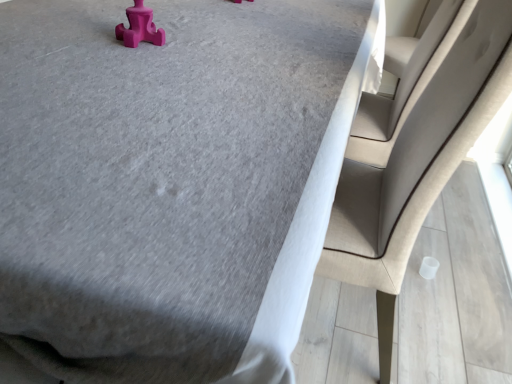
Question: Is beige fabric chair at right closer to the viewer compared to pink rubber toy at upper left?

Choices:
 (A) yes
 (B) no

Answer: (A)

Question: From the image's perspective, is beige fabric chair at right below pink rubber toy at upper left?

Choices:
 (A) yes
 (B) no

Answer: (A)

Question: Would you say beige fabric chair at right is a long distance from pink rubber toy at upper left?

Choices:
 (A) no
 (B) yes

Answer: (A)

Question: Considering the relative sizes of beige fabric chair at right and pink rubber toy at upper left in the image provided, is beige fabric chair at right shorter than pink rubber toy at upper left?

Choices:
 (A) no
 (B) yes

Answer: (A)

Question: Can you confirm if beige fabric chair at right is positioned to the left of pink rubber toy at upper left?

Choices:
 (A) no
 (B) yes

Answer: (A)

Question: Is beige fabric chair at right looking in the opposite direction of pink rubber toy at upper left?

Choices:
 (A) no
 (B) yes

Answer: (A)

Question: Is pink rubber toy at upper left not near beige fabric chair at right?

Choices:
 (A) no
 (B) yes

Answer: (A)

Question: Can you confirm if pink rubber toy at upper left is smaller than beige fabric chair at right?

Choices:
 (A) no
 (B) yes

Answer: (B)

Question: From a real-world perspective, does pink rubber toy at upper left sit lower than beige fabric chair at right?

Choices:
 (A) yes
 (B) no

Answer: (B)

Question: Considering the relative sizes of pink rubber toy at upper left and beige fabric chair at right in the image provided, is pink rubber toy at upper left shorter than beige fabric chair at right?

Choices:
 (A) no
 (B) yes

Answer: (B)

Question: Considering the relative sizes of pink rubber toy at upper left and beige fabric chair at right in the image provided, is pink rubber toy at upper left wider than beige fabric chair at right?

Choices:
 (A) yes
 (B) no

Answer: (B)

Question: Can you confirm if pink rubber toy at upper left is taller than beige fabric chair at right?

Choices:
 (A) yes
 (B) no

Answer: (B)

Question: Looking at their shapes, would you say pink rubber toy at upper left is wider or thinner than beige fabric chair at right?

Choices:
 (A) thin
 (B) wide

Answer: (A)